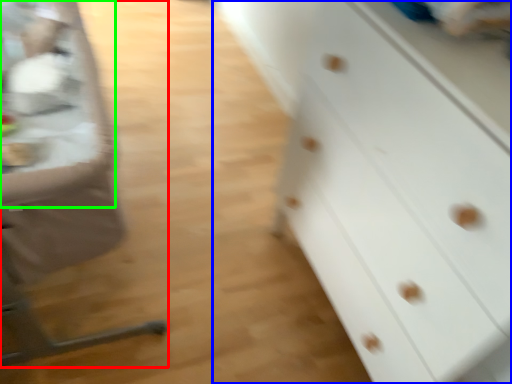
Question: Estimate the real-world distances between objects in this image. Which object is farther from feeding chair (highlighted by a red box), chest of drawers (highlighted by a blue box) or table (highlighted by a green box)?

Choices:
 (A) chest of drawers
 (B) table

Answer: (A)